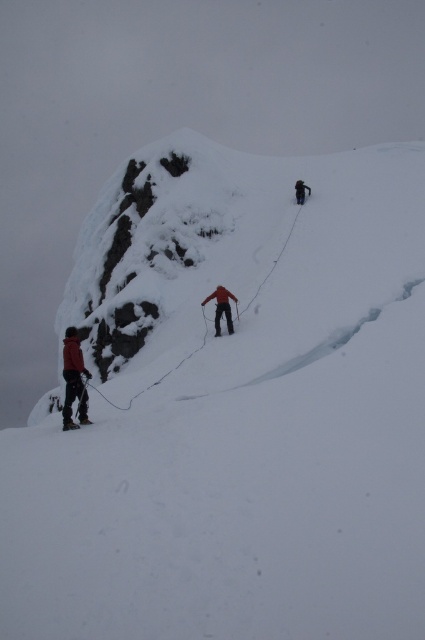
Between matte red jacket at lower left and dark gray fabric jacket at upper center, which one is positioned lower?

matte red jacket at lower left

Which is behind, point (81, 390) or point (297, 188)?

The point (297, 188) is more distant.

Who is more forward, (65, 358) or (297, 193)?

Positioned in front is point (65, 358).

You are a GUI agent. You are given a task and a screenshot of the screen. Output one action in this format:
    pyautogui.click(x=<x>, y=<y>)
    Task: Click on the matte red jacket at lower left
    
    Given the screenshot: What is the action you would take?
    pyautogui.click(x=73, y=380)

Is point (81, 387) farther from viewer compared to point (204, 300)?

No.

Find the location of a particular element. This screenshot has width=425, height=640. matte red jacket at lower left is located at coordinates (73, 380).

Can you confirm if matte red jacket at lower left is positioned above matte black ski at lower left?

Yes, matte red jacket at lower left is above matte black ski at lower left.

Can you confirm if matte red jacket at lower left is shorter than matte black ski at lower left?

No, matte red jacket at lower left is not shorter than matte black ski at lower left.

Is point (64, 406) in front of point (62, 428)?

No, it is not.

In order to click on matte red jacket at lower left in this screenshot , I will do `click(73, 380)`.